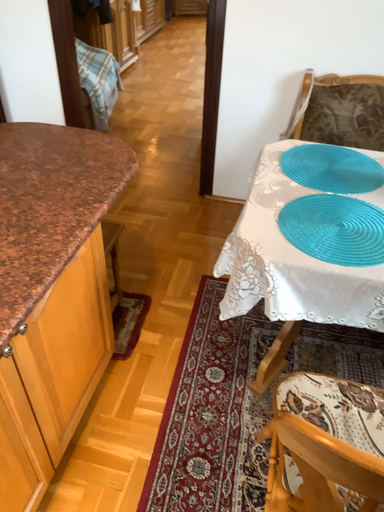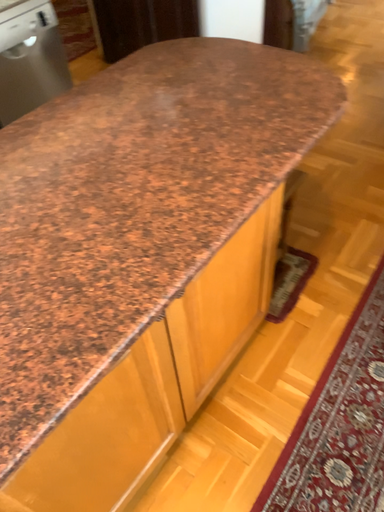
Question: Which way did the camera rotate in the video?

Choices:
 (A) rotated right
 (B) rotated left

Answer: (B)